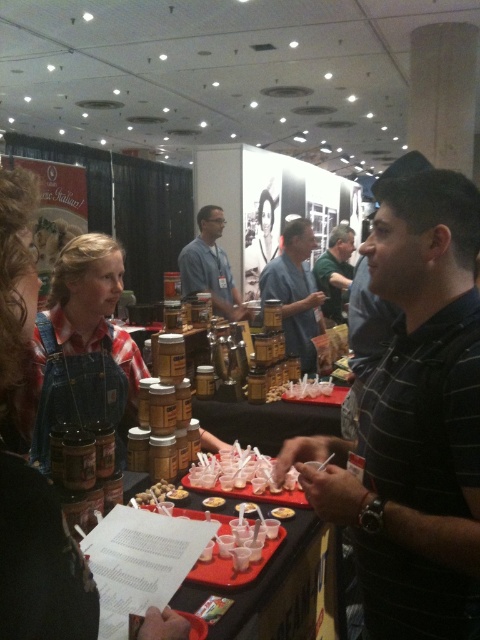
Does matte brown canister at center have a smaller size compared to translucent plastic cups at center?

Incorrect, matte brown canister at center is not smaller in size than translucent plastic cups at center.

Between matte brown canister at center and translucent plastic cups at center, which one has less height?

translucent plastic cups at center is shorter.

Is point (294, 304) closer to viewer compared to point (215, 456)?

No.

Locate an element on the screen. This screenshot has height=640, width=480. matte brown canister at center is located at coordinates (296, 292).

Does brown matte nuts at center appear over translucent plastic cup at center?

Yes.

From the picture: Between brown matte nuts at center and translucent plastic cup at center, which one has more height?

translucent plastic cup at center

What do you see at coordinates (159, 492) in the screenshot? Image resolution: width=480 pixels, height=640 pixels. I see `brown matte nuts at center` at bounding box center [159, 492].

At what (x,y) coordinates should I click in order to perform the action: click on brown matte nuts at center. Please return your answer as a coordinate pair (x, y). This screenshot has height=640, width=480. Looking at the image, I should click on (159, 492).

Describe the element at coordinates (415, 420) in the screenshot. I see `black striped shirt at right` at that location.

Is point (412, 202) positioned after point (167, 481)?

No, (412, 202) is in front of (167, 481).

Find the location of a particular element. This screenshot has width=480, height=640. black striped shirt at right is located at coordinates (415, 420).